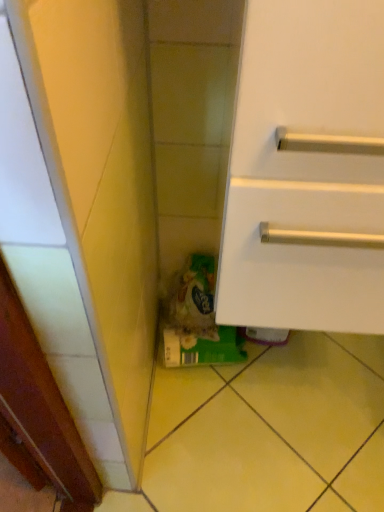
Question: From a real-world perspective, is white matte cabinet at lower right positioned above or below green plastic bag at lower center?

Choices:
 (A) below
 (B) above

Answer: (B)

Question: From the image's perspective, is white matte cabinet at lower right positioned above or below green plastic bag at lower center?

Choices:
 (A) above
 (B) below

Answer: (A)

Question: Looking at their shapes, would you say white matte cabinet at lower right is wider or thinner than green plastic bag at lower center?

Choices:
 (A) wide
 (B) thin

Answer: (A)

Question: From a real-world perspective, is green plastic bag at lower center positioned above or below white matte cabinet at lower right?

Choices:
 (A) below
 (B) above

Answer: (A)

Question: In terms of size, does green plastic bag at lower center appear bigger or smaller than white matte cabinet at lower right?

Choices:
 (A) big
 (B) small

Answer: (B)

Question: Is point (168, 310) positioned closer to the camera than point (314, 154)?

Choices:
 (A) farther
 (B) closer

Answer: (A)

Question: In the image, is green plastic bag at lower center positioned in front of or behind white matte cabinet at lower right?

Choices:
 (A) behind
 (B) front

Answer: (A)